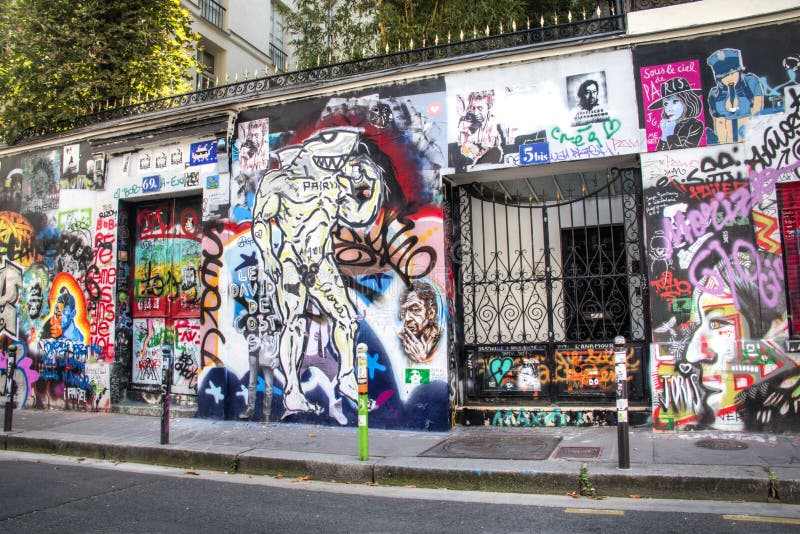
Identify the location of door. (166, 293).